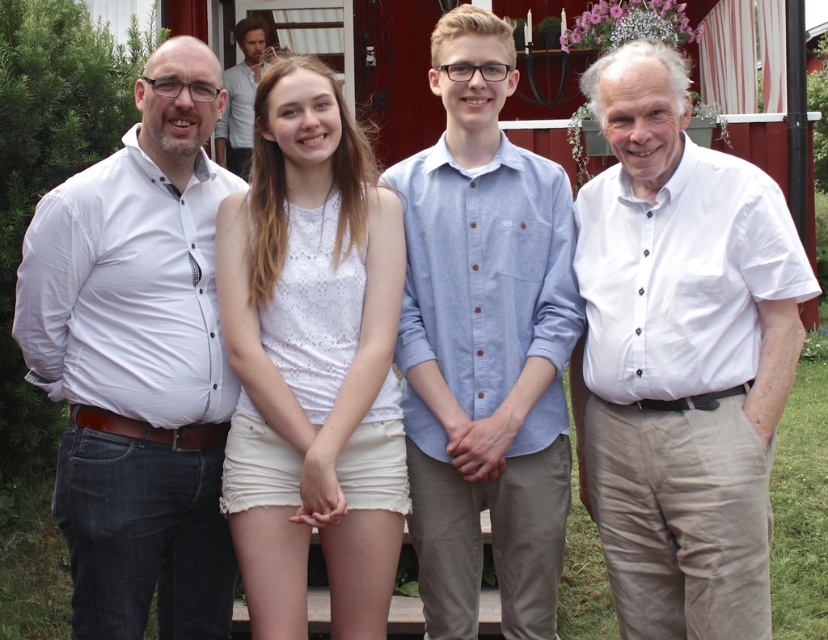
You are a photographer trying to capture a group photo of the white shirt at left and the light blue chambray shirt at center. If your camera has a minimum focus distance of 1.5 meters, will you be able to focus on both subjects clearly?

The distance between the white shirt at left and the light blue chambray shirt at center is 1.62 meters. Since the minimum focus distance of the camera is 1.5 meters, the photographer can focus on both subjects clearly as the distance between them exceeds the minimum requirement.

You are standing in front of the red wooden structure and notice two points marked in the image. Which point, point (229,403) or point (225,134), is closer to you?

Point (229,403) is closer to the viewer than point (225,134).

You are standing in front of the red wooden structure and want to reach both point (310, 340) and point (234, 161). Which point should you reach first to minimize the distance walked?

You should reach point (310, 340) first because it is closer to you than point (234, 161).